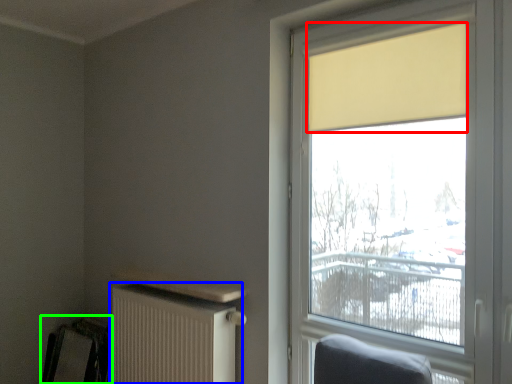
Question: Based on their relative distances, which object is nearer to curtain (highlighted by a red box)? Choose from radiator (highlighted by a blue box) and swivel chair (highlighted by a green box).

Choices:
 (A) radiator
 (B) swivel chair

Answer: (A)